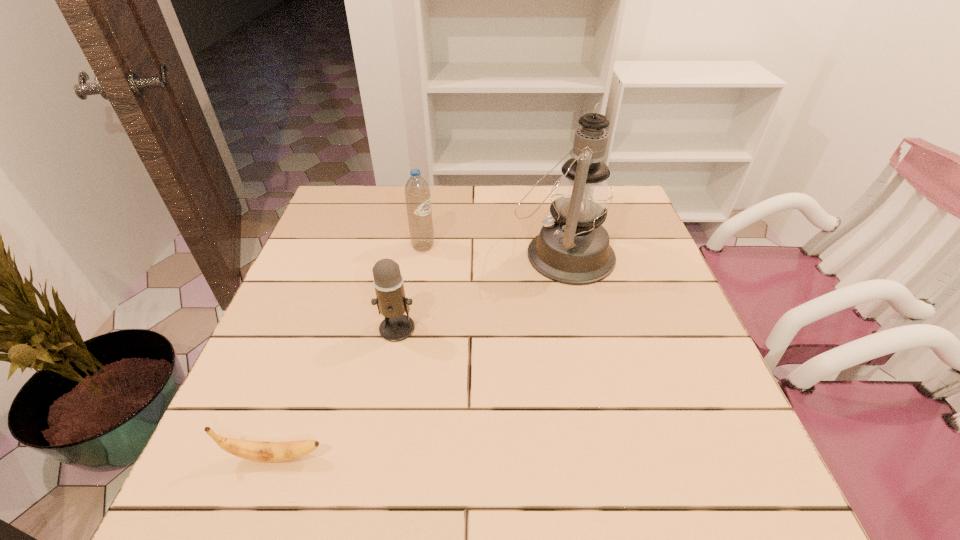
I want to click on free spot between the microphone and the shortest object, so click(337, 393).

Locate an element on the screen. empty space between the nearest object and the microphone is located at coordinates (337, 393).

Select which object is the second closest to the nearest object. Please provide its 2D coordinates. Your answer should be formatted as a tuple, i.e. [(x, y)], where the tuple contains the x and y coordinates of a point satisfying the conditions above.

[(573, 248)]

Identify which object is the third closest to the water bottle. Please provide its 2D coordinates. Your answer should be formatted as a tuple, i.e. [(x, y)], where the tuple contains the x and y coordinates of a point satisfying the conditions above.

[(261, 451)]

Identify the location of free region that satisfies the following two spatial constraints: 1. on the front side of the water bottle; 2. on the peel of the leftmost object from the top. (391, 457).

Locate an element on the screen. This screenshot has height=540, width=960. vacant space that satisfies the following two spatial constraints: 1. on the back side of the third farthest object; 2. on the left side of the rightmost object is located at coordinates (411, 254).